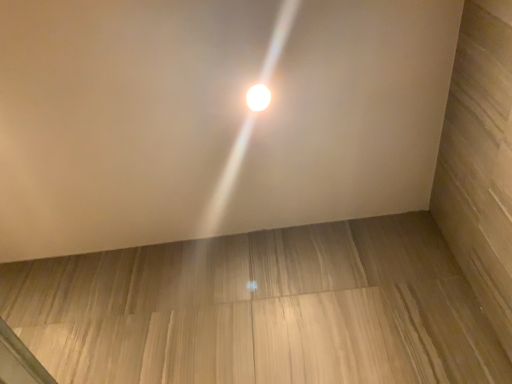
What are the coordinates of `vacant area that is in front of white glossy light bulb at upper center` in the screenshot? It's located at (248, 43).